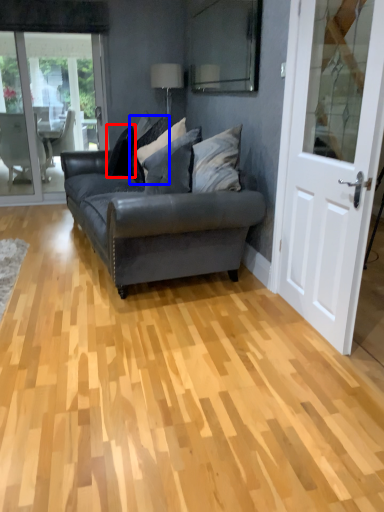
Question: Among these objects, which one is farthest to the camera, pillow (highlighted by a red box) or pillow (highlighted by a blue box)?

Choices:
 (A) pillow
 (B) pillow

Answer: (A)